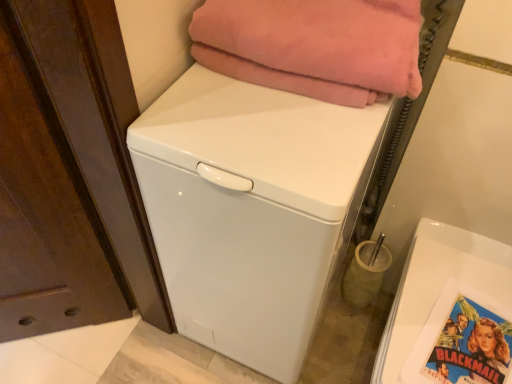
The width and height of the screenshot is (512, 384). In order to click on vacant region above blue glossy comic book at lower right (from a real-world perspective) in this screenshot , I will do `click(477, 350)`.